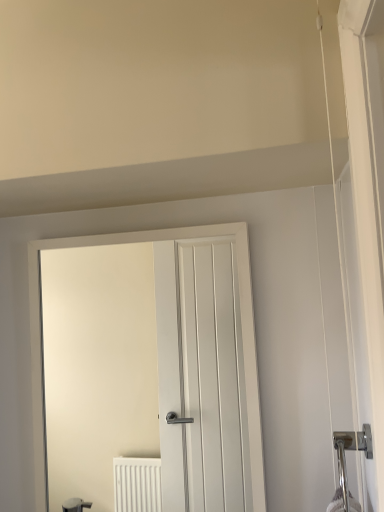
This screenshot has height=512, width=384. What do you see at coordinates (241, 323) in the screenshot?
I see `white matte door at center` at bounding box center [241, 323].

Measure the distance between point (258,421) and camera.

The distance of point (258,421) from camera is 96.30 centimeters.

I want to click on white matte door at center, so click(x=241, y=323).

The width and height of the screenshot is (384, 512). What do you see at coordinates (354, 450) in the screenshot?
I see `polished chrome door handle at right` at bounding box center [354, 450].

Locate an element on the screen. Image resolution: width=384 pixels, height=512 pixels. polished chrome door handle at right is located at coordinates (354, 450).

Measure the distance between point (336, 441) and camera.

Point (336, 441) is 30.83 inches away from camera.

Locate an element on the screen. The image size is (384, 512). white matte door at center is located at coordinates (241, 323).

Would you say white matte door at center is to the left or to the right of polished chrome door handle at right in the picture?

white matte door at center is to the left of polished chrome door handle at right.

Does white matte door at center lie behind polished chrome door handle at right?

Yes, white matte door at center is further from the viewer.

Is point (83, 243) less distant than point (334, 435)?

No, it is behind (334, 435).

From the image's perspective, relative to polished chrome door handle at right, is white matte door at center above or below?

Clearly, from the image's perspective, white matte door at center is above polished chrome door handle at right.

From a real-world perspective, is white matte door at center positioned over polished chrome door handle at right based on gravity?

Yes, from a real-world perspective, white matte door at center is over polished chrome door handle at right

Is white matte door at center wider or thinner than polished chrome door handle at right?

A: Considering their sizes, white matte door at center looks slimmer than polished chrome door handle at right.

Considering the sizes of objects white matte door at center and polished chrome door handle at right in the image provided, who is taller, white matte door at center or polished chrome door handle at right?

white matte door at center.

Is white matte door at center bigger or smaller than polished chrome door handle at right?

Considering their sizes, white matte door at center takes up more space than polished chrome door handle at right.

Is white matte door at center situated inside polished chrome door handle at right or outside?

white matte door at center is not inside polished chrome door handle at right, it's outside.

Would you say white matte door at center is a long distance from polished chrome door handle at right?

No, white matte door at center is in close proximity to polished chrome door handle at right.

Is white matte door at center turned away from polished chrome door handle at right?

No, white matte door at center is not facing away from polished chrome door handle at right.

How different are the orientations of white matte door at center and polished chrome door handle at right in degrees?

The angle between the facing direction of white matte door at center and the facing direction of polished chrome door handle at right is 0.799 degrees.

How much distance is there between white matte door at center and polished chrome door handle at right?

A distance of 14.54 inches exists between white matte door at center and polished chrome door handle at right.

Image resolution: width=384 pixels, height=512 pixels. I want to click on door handle lying on the right of white matte door at center, so click(354, 450).

Is polished chrome door handle at right at the right side of white matte door at center?

Correct, you'll find polished chrome door handle at right to the right of white matte door at center.

Is polished chrome door handle at right in front of or behind white matte door at center in the image?

Visually, polished chrome door handle at right is located in front of white matte door at center.

Considering the points (346, 476) and (244, 260), which point is behind, point (346, 476) or point (244, 260)?

The point (244, 260) is farther from the camera.

From the image's perspective, is polished chrome door handle at right beneath white matte door at center?

Indeed, from the image's perspective, polished chrome door handle at right is shown beneath white matte door at center.

From a real-world perspective, is polished chrome door handle at right above or below white matte door at center?

From a real-world perspective, polished chrome door handle at right is physically below white matte door at center.

Does polished chrome door handle at right have a greater width compared to white matte door at center?

Yes.

Considering the relative sizes of polished chrome door handle at right and white matte door at center in the image provided, is polished chrome door handle at right taller than white matte door at center?

In fact, polished chrome door handle at right may be shorter than white matte door at center.

Looking at the image, does polished chrome door handle at right seem bigger or smaller compared to white matte door at center?

Considering their sizes, polished chrome door handle at right takes up less space than white matte door at center.

Can white matte door at center be found inside polished chrome door handle at right?

No, white matte door at center is located outside of polished chrome door handle at right.

Can you see polished chrome door handle at right touching white matte door at center?

polished chrome door handle at right and white matte door at center are clearly separated.

Is polished chrome door handle at right facing towards white matte door at center?

No, polished chrome door handle at right does not turn towards white matte door at center.

Image resolution: width=384 pixels, height=512 pixels. In order to click on door above the polished chrome door handle at right (from the image's perspective) in this screenshot , I will do `click(241, 323)`.

Where is `door that appears on the left of polished chrome door handle at right`? The width and height of the screenshot is (384, 512). door that appears on the left of polished chrome door handle at right is located at coordinates (241, 323).

Where is `door above the polished chrome door handle at right (from a real-world perspective)`? door above the polished chrome door handle at right (from a real-world perspective) is located at coordinates (241, 323).